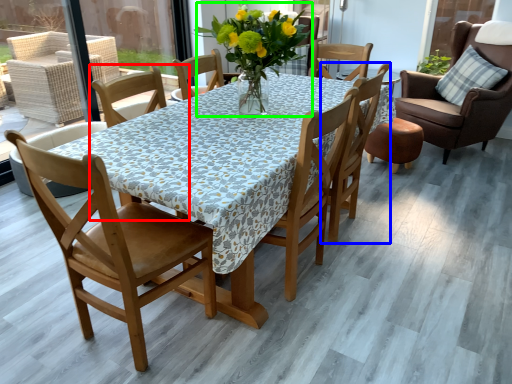
Question: Which is nearer to the chair (highlighted by a red box)? chair (highlighted by a blue box) or floral arrangement (highlighted by a green box).

Choices:
 (A) chair
 (B) floral arrangement

Answer: (B)